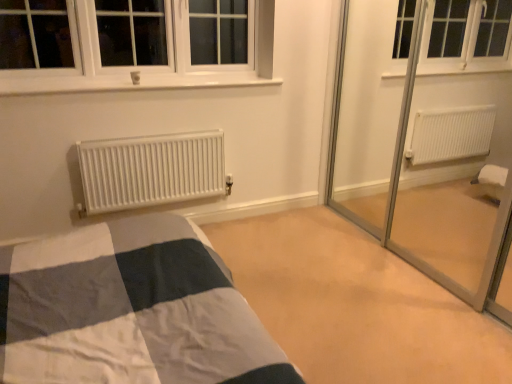
Question: In terms of width, does white matte radiator at center look wider or thinner when compared to beige carpet at center?

Choices:
 (A) wide
 (B) thin

Answer: (B)

Question: Is white matte radiator at center bigger or smaller than beige carpet at center?

Choices:
 (A) big
 (B) small

Answer: (B)

Question: From a real-world perspective, relative to beige carpet at center, is white matte radiator at center vertically above or below?

Choices:
 (A) above
 (B) below

Answer: (A)

Question: Choose the correct answer: Is beige carpet at center inside white matte radiator at center or outside it?

Choices:
 (A) outside
 (B) inside

Answer: (A)

Question: Considering the positions of beige carpet at center and white matte radiator at center in the image, is beige carpet at center taller or shorter than white matte radiator at center?

Choices:
 (A) tall
 (B) short

Answer: (B)

Question: Based on their positions, is beige carpet at center located to the left or right of white matte radiator at center?

Choices:
 (A) right
 (B) left

Answer: (A)

Question: Is point (297, 334) closer or farther from the camera than point (144, 145)?

Choices:
 (A) closer
 (B) farther

Answer: (A)